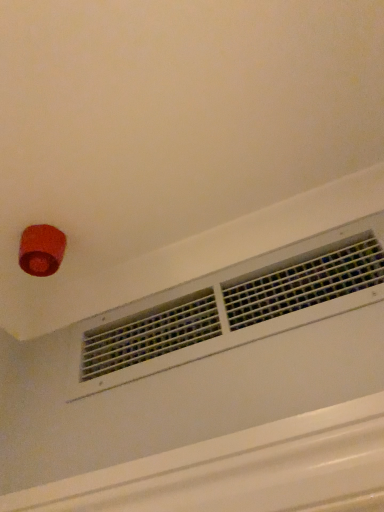
From the picture: Measure the distance between white textured vent at upper center and camera.

white textured vent at upper center is 76.45 centimeters away from camera.

Describe the element at coordinates (236, 307) in the screenshot. Image resolution: width=384 pixels, height=512 pixels. I see `white textured vent at upper center` at that location.

Identify the location of white textured vent at upper center. This screenshot has width=384, height=512. [236, 307].

The height and width of the screenshot is (512, 384). In order to click on white textured vent at upper center in this screenshot , I will do (236, 307).